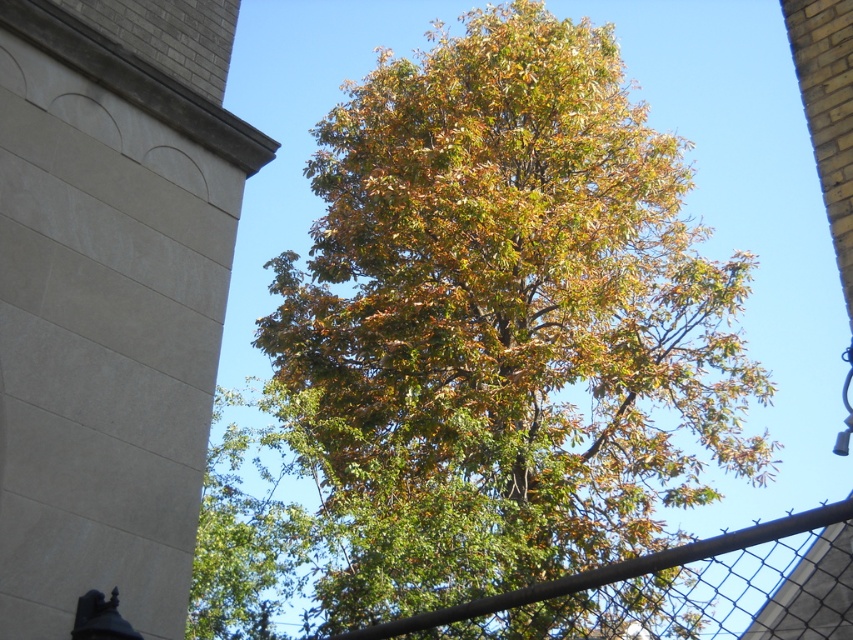
Question: Among these objects, which one is nearest to the camera?

Choices:
 (A) green leafy tree at center
 (B) beige stone tower at upper left

Answer: (B)

Question: Is green leafy tree at center positioned in front of beige stone tower at upper left?

Choices:
 (A) yes
 (B) no

Answer: (B)

Question: Estimate the real-world distances between objects in this image. Which object is closer to the rustic metal fence at center?

Choices:
 (A) beige stone tower at upper left
 (B) green leafy tree at center

Answer: (A)

Question: Is green leafy tree at center positioned at the back of rustic metal fence at center?

Choices:
 (A) no
 (B) yes

Answer: (B)

Question: Can you confirm if beige stone tower at upper left is positioned to the right of rustic metal fence at center?

Choices:
 (A) yes
 (B) no

Answer: (B)

Question: Considering the real-world distances, which object is closest to the rustic metal fence at center?

Choices:
 (A) green leafy tree at center
 (B) beige stone tower at upper left

Answer: (B)